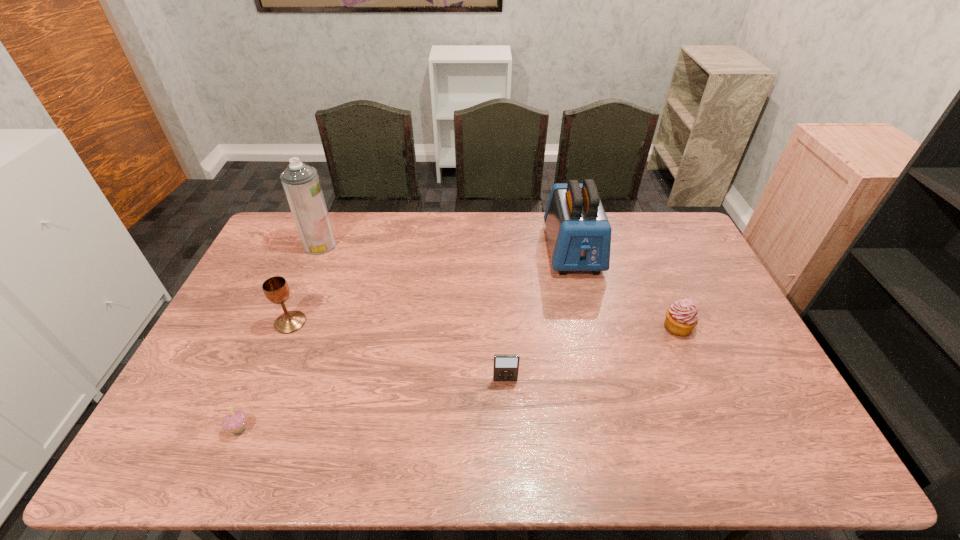
The height and width of the screenshot is (540, 960). In order to click on aerosol can in this screenshot , I will do `click(301, 183)`.

Identify the location of the second object from right to left. (579, 234).

Where is `the fifth shortest object`? This screenshot has height=540, width=960. the fifth shortest object is located at coordinates (579, 234).

Image resolution: width=960 pixels, height=540 pixels. What are the coordinates of `the third tallest object` in the screenshot? It's located at (276, 289).

At what (x,y) coordinates should I click in order to perform the action: click on the right cupcake. Please return your answer as a coordinate pair (x, y). Looking at the image, I should click on (681, 317).

Find the location of a particular element. The width and height of the screenshot is (960, 540). the taller cupcake is located at coordinates click(x=681, y=317).

You are a GUI agent. You are given a task and a screenshot of the screen. Output one action in this format:
    pyautogui.click(x=<x>, y=<y>)
    Task: Click on the second nearest object
    
    Given the screenshot: What is the action you would take?
    pyautogui.click(x=505, y=366)

The image size is (960, 540). Identify the location of the third object from right to left. (505, 366).

Identify the location of the nearer cupcake. coord(235,422).

This screenshot has height=540, width=960. What are the coordinates of `the nearest object` in the screenshot? It's located at (235, 422).